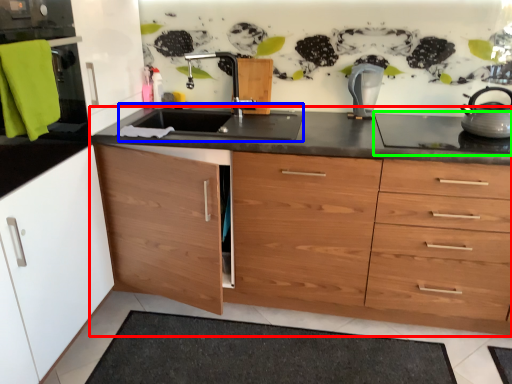
Question: Considering the real-world distances, which object is farthest from countertop (highlighted by a red box)? sink (highlighted by a blue box) or gas stove (highlighted by a green box)?

Choices:
 (A) sink
 (B) gas stove

Answer: (B)